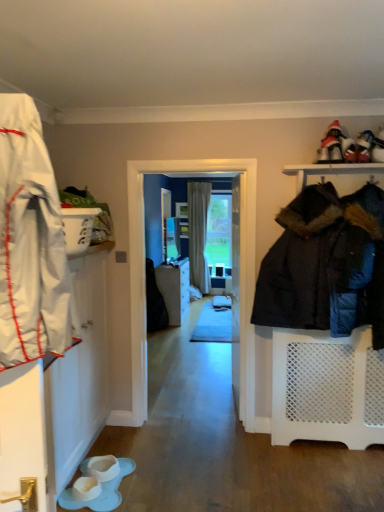
Question: Is white fabric shoe at upper right, arranged as the first footwear when viewed from the right, shorter than matte gray cabinet at center?

Choices:
 (A) yes
 (B) no

Answer: (A)

Question: Considering the relative sizes of white fabric shoe at upper right, the 2th footwear in the bottom-to-top sequence, and matte gray cabinet at center in the image provided, is white fabric shoe at upper right, the 2th footwear in the bottom-to-top sequence, smaller than matte gray cabinet at center?

Choices:
 (A) no
 (B) yes

Answer: (B)

Question: Is white fabric shoe at upper right, the 2th footwear in the bottom-to-top sequence, to the left of matte gray cabinet at center from the viewer's perspective?

Choices:
 (A) no
 (B) yes

Answer: (A)

Question: From the image's perspective, is white fabric shoe at upper right, which is the 2th footwear in left-to-right order, beneath matte gray cabinet at center?

Choices:
 (A) yes
 (B) no

Answer: (B)

Question: Are white fabric shoe at upper right, which is the 2th footwear in left-to-right order, and matte gray cabinet at center making contact?

Choices:
 (A) yes
 (B) no

Answer: (B)

Question: Considering the relative sizes of white fabric shoe at upper right, which is the 2th footwear in left-to-right order, and matte gray cabinet at center in the image provided, is white fabric shoe at upper right, which is the 2th footwear in left-to-right order, wider than matte gray cabinet at center?

Choices:
 (A) no
 (B) yes

Answer: (A)

Question: From the image's perspective, is beige fabric curtain at center located above white rubber boot at lower center, placed as the first footwear when sorted from bottom to top?

Choices:
 (A) no
 (B) yes

Answer: (B)

Question: Does beige fabric curtain at center appear on the left side of white rubber boot at lower center, which is counted as the first footwear, starting from the left?

Choices:
 (A) no
 (B) yes

Answer: (A)

Question: Considering the relative sizes of beige fabric curtain at center and white rubber boot at lower center, which is counted as the first footwear, starting from the left, in the image provided, is beige fabric curtain at center wider than white rubber boot at lower center, which is counted as the first footwear, starting from the left,?

Choices:
 (A) no
 (B) yes

Answer: (A)

Question: Considering the relative sizes of beige fabric curtain at center and white rubber boot at lower center, the 2th footwear when ordered from top to bottom, in the image provided, is beige fabric curtain at center taller than white rubber boot at lower center, the 2th footwear when ordered from top to bottom,?

Choices:
 (A) yes
 (B) no

Answer: (A)

Question: Does beige fabric curtain at center have a lesser width compared to white rubber boot at lower center, positioned as the second footwear in right-to-left order?

Choices:
 (A) yes
 (B) no

Answer: (A)

Question: Can you confirm if beige fabric curtain at center is shorter than white rubber boot at lower center, which is counted as the first footwear, starting from the left?

Choices:
 (A) no
 (B) yes

Answer: (A)

Question: Is matte gray cabinet at center oriented away from beige fabric curtain at center?

Choices:
 (A) yes
 (B) no

Answer: (B)